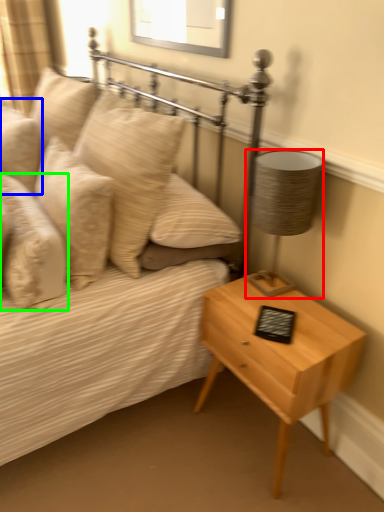
Question: Which object is the closest to the lamp (highlighted by a red box)? Choose among these: pillow (highlighted by a blue box) or pillow (highlighted by a green box).

Choices:
 (A) pillow
 (B) pillow

Answer: (B)